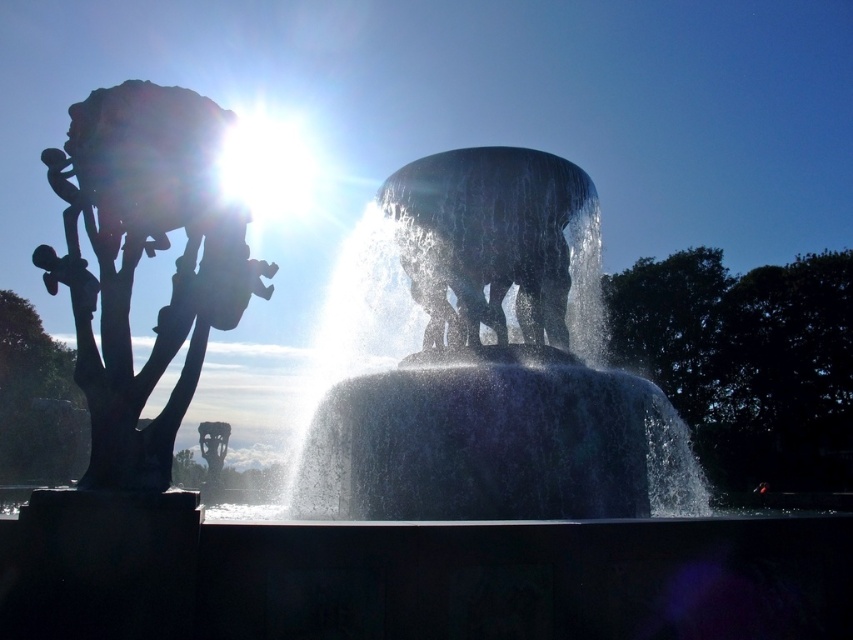
You are standing in the park and see the translucent glass water at center and the green leafy tree at center. Which object is positioned higher in the scene?

The translucent glass water at center is located above the green leafy tree at center, so it is positioned higher in the scene.

You are planning to place a new bench in the garden, and you want to ensure it fits between the glossy stone elephant at center and the matte gray tree at left. The bench is 1.2 meters wide. Can the bench fit between them?

The glossy stone elephant at center has a lesser width compared to matte gray tree at left, so the distance between them is wider than the elephant. However, the exact width of the space isn

You are standing in the park and see the translucent glass water at center and the green leafy tree at center. Which object is closer to you?

The translucent glass water at center is closer to you because it is in front of the green leafy tree at center.